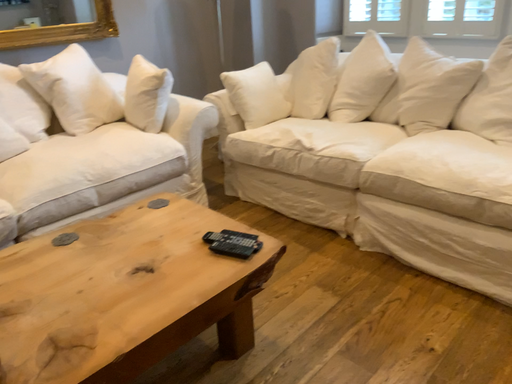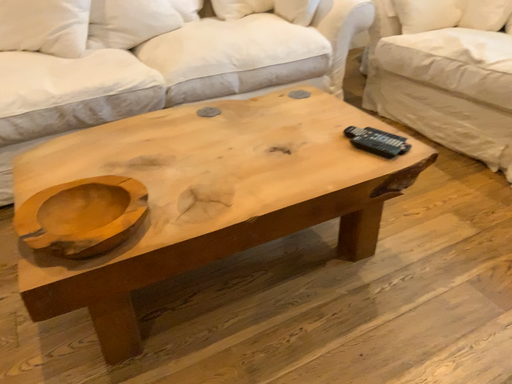
Question: Which way did the camera rotate in the video?

Choices:
 (A) rotated upward
 (B) rotated downward

Answer: (B)